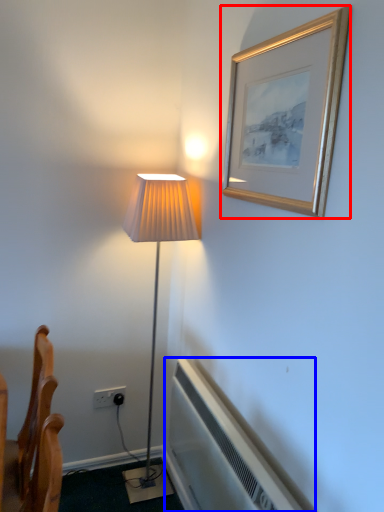
Question: Among these objects, which one is farthest to the camera, picture frame (highlighted by a red box) or air conditioner (highlighted by a blue box)?

Choices:
 (A) picture frame
 (B) air conditioner

Answer: (B)